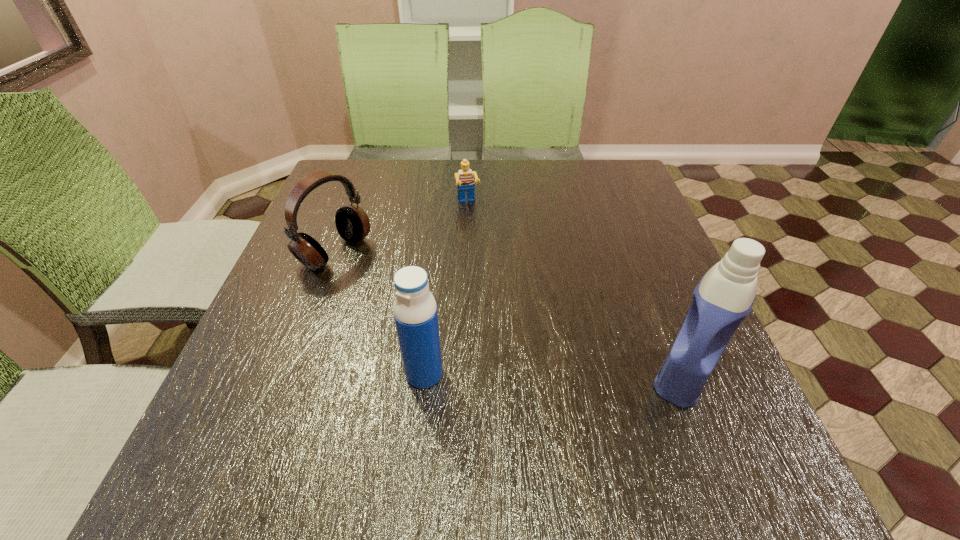
Where is `vacant space located on the face of the Lego`? vacant space located on the face of the Lego is located at coordinates (480, 248).

This screenshot has height=540, width=960. I want to click on free space located on the face of the Lego, so click(477, 235).

At what (x,y) coordinates should I click in order to perform the action: click on free spot located 0.140m on the face of the Lego. Please return your answer as a coordinate pair (x, y). Looking at the image, I should click on (479, 243).

You are a GUI agent. You are given a task and a screenshot of the screen. Output one action in this format:
    pyautogui.click(x=<x>, y=<y>)
    Task: Click on the vacant region located 0.400m on the ear pads of the leftmost object
    The height and width of the screenshot is (540, 960).
    Given the screenshot: What is the action you would take?
    pyautogui.click(x=504, y=350)

At what (x,y) coordinates should I click in order to perform the action: click on vacant area situated 0.340m on the ear pads of the leftmost object. Please return your answer as a coordinate pair (x, y). Looking at the image, I should click on (479, 335).

Where is `vacant point located 0.250m on the ear pads of the leftmost object`? The height and width of the screenshot is (540, 960). vacant point located 0.250m on the ear pads of the leftmost object is located at coordinates (444, 315).

I want to click on object at the far edge, so click(464, 178).

Locate an element on the screen. Image resolution: width=960 pixels, height=540 pixels. water bottle present at the near edge is located at coordinates (415, 312).

The image size is (960, 540). What are the coordinates of `detergent that is at the near edge` in the screenshot? It's located at (724, 297).

Locate an element on the screen. This screenshot has height=540, width=960. object located at the left edge is located at coordinates (352, 223).